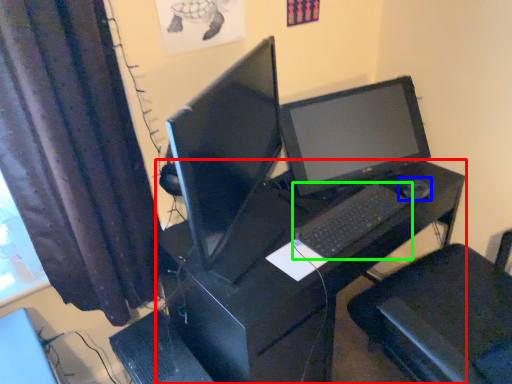
Question: Based on their relative distances, which object is farther from desk (highlighted by a red box)? Choose from mouse (highlighted by a blue box) and computer keyboard (highlighted by a green box).

Choices:
 (A) mouse
 (B) computer keyboard

Answer: (A)